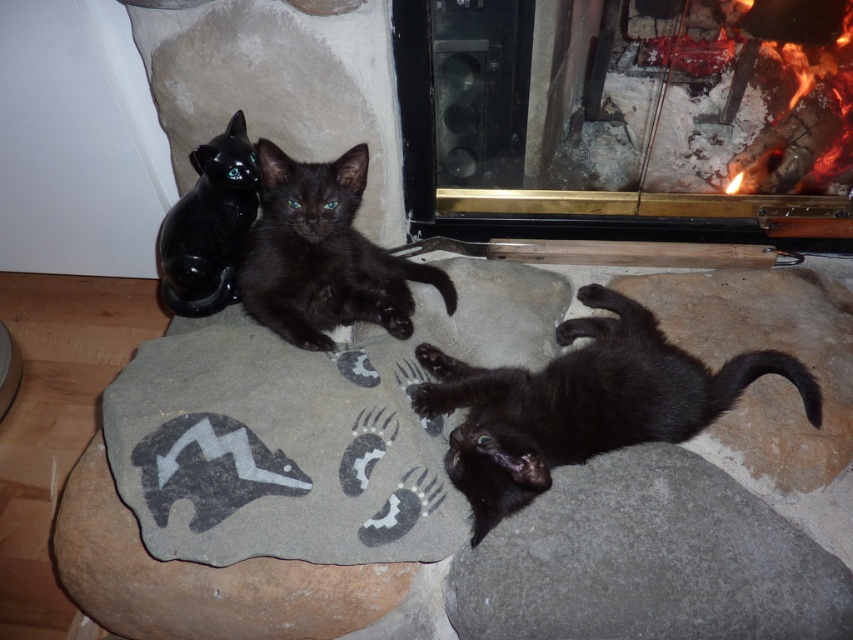
You are a photographer trying to capture a closeup shot of the charcoal ash fireplace at upper right and the black fur cat at lower right. Since you want to focus on the fireplace, which object should you position closer to the camera?

You should position the charcoal ash fireplace at upper right closer to the camera since it has a greater height than the black fur cat at lower right, allowing it to be the main focus in the closeup shot.

You are a photographer trying to capture both the black fur cat at lower right and the matte black kitten at center in a single shot. Based on their positions, which one would require you to adjust your camera angle more to include in the frame?

The black fur cat at lower right might require adjusting the camera angle more since it is wider than the matte black kitten at center, so you need to ensure the frame can accommodate its larger width.